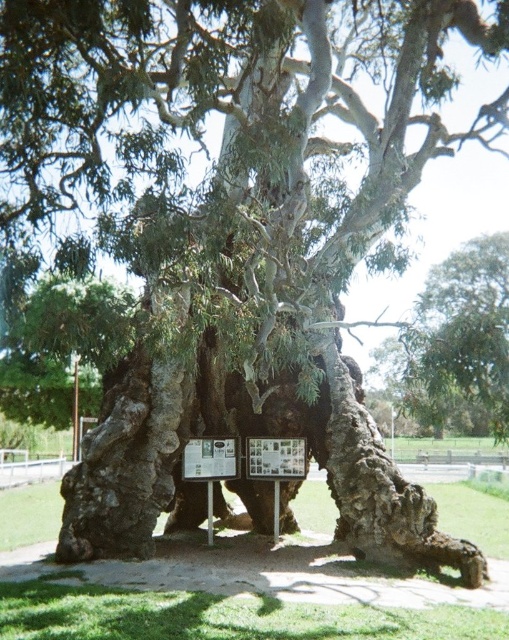
You are standing in the park looking at the ancient eucalyptus tree. There are two points marked on the tree trunk. One is at coordinates point [291,440] and the other is at point [218,460]. Which point is closer to you?

Point [291,440] is closer to you because it is further to the viewer than point [218,460].

You are a visitor in the park and want to read both the wooden signboard at center and the metallic plaque at center. Which one should you look at first if you want to read them from left to right?

You should look at the metallic plaque at center first because the wooden signboard at center is to the right of it, so reading from left to right starts with the metallic plaque at center.